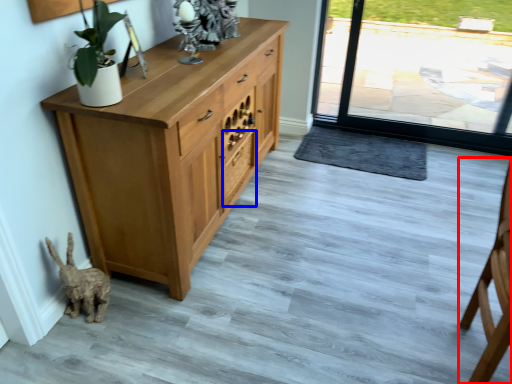
Question: Which of the following is the farthest to the observer, chair (highlighted by a red box) or drawer (highlighted by a blue box)?

Choices:
 (A) chair
 (B) drawer

Answer: (B)